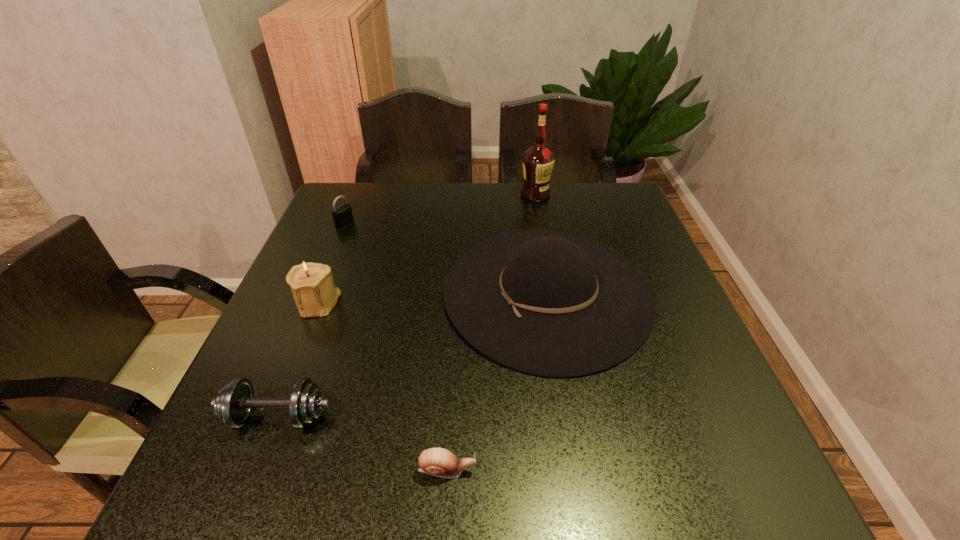
Where is `dumbbell at the left edge`? Image resolution: width=960 pixels, height=540 pixels. dumbbell at the left edge is located at coordinates (233, 404).

Locate an element on the screen. object that is at the right edge is located at coordinates (548, 303).

Find the location of `object located in the far left corner section of the desktop`. object located in the far left corner section of the desktop is located at coordinates (342, 216).

Image resolution: width=960 pixels, height=540 pixels. Identify the location of free space at the far edge of the desktop. click(x=456, y=211).

Locate an element on the screen. The image size is (960, 540). free space at the left edge is located at coordinates (311, 256).

Image resolution: width=960 pixels, height=540 pixels. I want to click on free space at the right edge of the desktop, so click(x=703, y=399).

Locate an element on the screen. The image size is (960, 540). free space at the far right corner of the desktop is located at coordinates (590, 224).

Where is `empty space between the candle_holder and the sombrero`? Image resolution: width=960 pixels, height=540 pixels. empty space between the candle_holder and the sombrero is located at coordinates (433, 298).

Identify the location of free point between the candle_holder and the sombrero. (433, 298).

The height and width of the screenshot is (540, 960). I want to click on free area in between the alcohol and the dumbbell, so click(x=406, y=306).